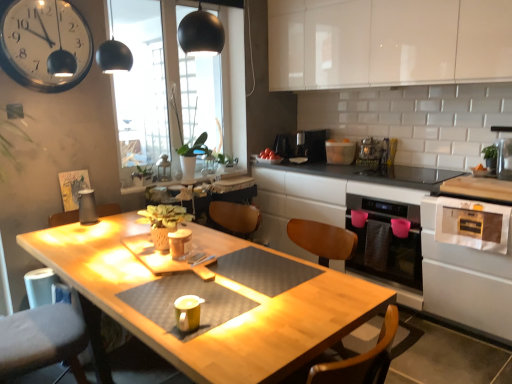
You are a GUI agent. You are given a task and a screenshot of the screen. Output one action in this format:
    pyautogui.click(x=<x>, y=<y>)
    Task: Click on the vacant space in metallic silver toaster at upper right, marked as the fifth appliance in a front-to-back arrangement (from a real-world perspective)
    This screenshot has width=512, height=384.
    Given the screenshot: What is the action you would take?
    pyautogui.click(x=369, y=162)